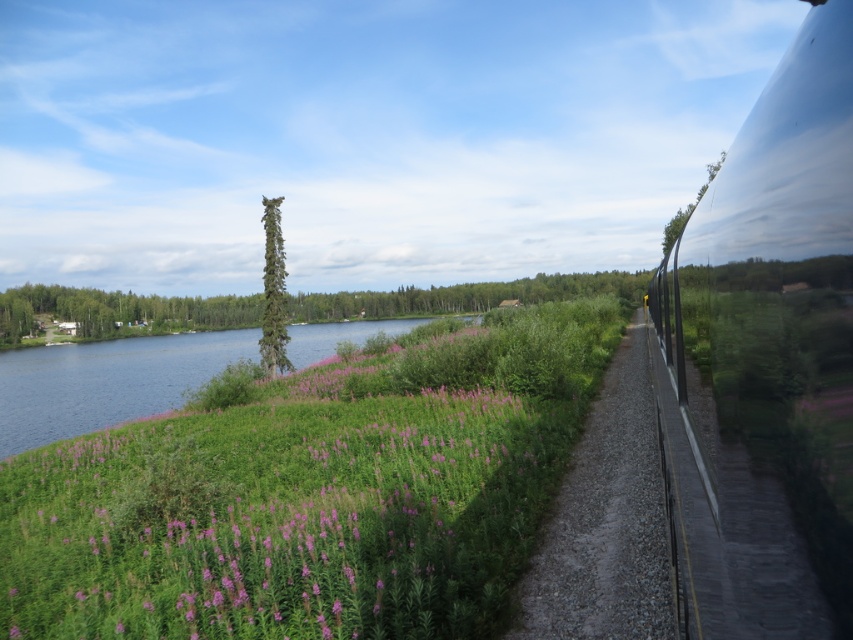
Measure the distance between glossy metallic train at right and gravel path at right.

A distance of 43.06 feet exists between glossy metallic train at right and gravel path at right.

Is point (746, 278) less distant than point (531, 566)?

Yes.

This screenshot has width=853, height=640. What do you see at coordinates (764, 356) in the screenshot?
I see `glossy metallic train at right` at bounding box center [764, 356].

This screenshot has height=640, width=853. Find the location of `glossy metallic train at right`. glossy metallic train at right is located at coordinates (764, 356).

Does green leafy tree at center have a lesser height compared to green textured tree at center?

In fact, green leafy tree at center may be taller than green textured tree at center.

Does point (285, 307) come closer to viewer compared to point (279, 218)?

Yes, point (285, 307) is in front of point (279, 218).

I want to click on green leafy tree at center, so click(x=119, y=310).

What do you see at coordinates (764, 356) in the screenshot?
I see `glossy metallic train at right` at bounding box center [764, 356].

Between glossy metallic train at right and green leafy tree at center, which one appears on the left side from the viewer's perspective?

From the viewer's perspective, green leafy tree at center appears more on the left side.

Is point (694, 276) closer to viewer compared to point (525, 304)?

Yes, point (694, 276) is in front of point (525, 304).

I want to click on glossy metallic train at right, so click(x=764, y=356).